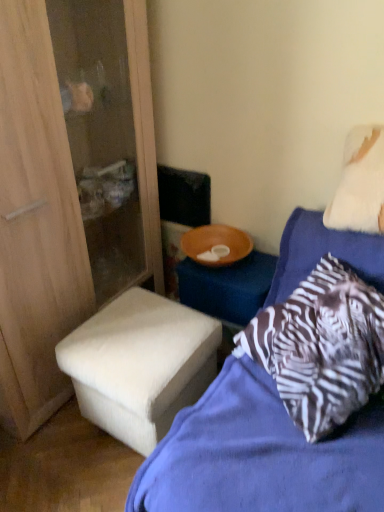
What do you see at coordinates (259, 455) in the screenshot? I see `zebra-patterned pillow at upper right` at bounding box center [259, 455].

You are a GUI agent. You are given a task and a screenshot of the screen. Output one action in this format:
    pyautogui.click(x=<x>, y=<y>)
    Task: Click on the zebra-patterned pillow at upper right
    This screenshot has width=384, height=512.
    Given the screenshot: What is the action you would take?
    pyautogui.click(x=259, y=455)

From the image's perspective, which object appears higher, white fluffy pillow at upper right or zebra-patterned pillow at upper right?

From the image's view, white fluffy pillow at upper right is above.

Is the position of white fluffy pillow at upper right less distant than that of zebra-patterned pillow at upper right?

No, white fluffy pillow at upper right is behind zebra-patterned pillow at upper right.

Considering the sizes of white fluffy pillow at upper right and zebra-patterned pillow at upper right in the image, is white fluffy pillow at upper right wider or thinner than zebra-patterned pillow at upper right?

Clearly, white fluffy pillow at upper right has less width compared to zebra-patterned pillow at upper right.

Is white fluffy pillow at upper right smaller than zebra-patterned pillow at upper right?

Yes, white fluffy pillow at upper right is smaller than zebra-patterned pillow at upper right.

Considering the sizes of objects zebra-patterned pillow at upper right and white fabric stool at lower left in the image provided, who is smaller, zebra-patterned pillow at upper right or white fabric stool at lower left?

Smaller between the two is white fabric stool at lower left.

Considering the relative sizes of zebra-patterned pillow at upper right and white fabric stool at lower left in the image provided, is zebra-patterned pillow at upper right taller than white fabric stool at lower left?

Yes.

From the image's perspective, which one is positioned lower, zebra-patterned pillow at upper right or white fabric stool at lower left?

white fabric stool at lower left.

Which object is wider, zebra-patterned pillow at upper right or white fabric stool at lower left?

Wider between the two is white fabric stool at lower left.

Which is closer to the camera, (342,225) or (71,340)?

The point (342,225) is closer.

Image resolution: width=384 pixels, height=512 pixels. I want to click on pillow above the white fabric stool at lower left (from the image's perspective), so click(360, 183).

Can you confirm if white fluffy pillow at upper right is taller than white fabric stool at lower left?

No.

Is white fluffy pillow at upper right to the left or to the right of white fabric stool at lower left in the image?

Clearly, white fluffy pillow at upper right is on the right of white fabric stool at lower left in the image.

Which is in front, zebra-patterned pillow at upper right or white fluffy pillow at upper right?

Positioned in front is zebra-patterned pillow at upper right.

From the image's perspective, relative to white fluffy pillow at upper right, is zebra-patterned pillow at upper right above or below?

Based on their image positions, zebra-patterned pillow at upper right is located beneath white fluffy pillow at upper right.

Considering the sizes of zebra-patterned pillow at upper right and white fluffy pillow at upper right in the image, is zebra-patterned pillow at upper right taller or shorter than white fluffy pillow at upper right?

Clearly, zebra-patterned pillow at upper right is taller compared to white fluffy pillow at upper right.

Is white fabric stool at lower left not near zebra-patterned pillow at upper right?

That's not correct — white fabric stool at lower left is a little close to zebra-patterned pillow at upper right.

Where is `bed in front of the white fabric stool at lower left`? This screenshot has width=384, height=512. bed in front of the white fabric stool at lower left is located at coordinates click(259, 455).

Based on the photo, can you confirm if white fabric ottoman at lower left is smaller than white fluffy pillow at upper right?

No.

How different are the orientations of white fabric ottoman at lower left and white fluffy pillow at upper right in degrees?

The facing directions of white fabric ottoman at lower left and white fluffy pillow at upper right are 86.3 degrees apart.

From the image's perspective, does white fabric ottoman at lower left appear higher than white fluffy pillow at upper right?

No, from the image's perspective, white fabric ottoman at lower left is not over white fluffy pillow at upper right.

Between white fabric ottoman at lower left and white fabric stool at lower left, which one has larger size?

With larger size is white fabric ottoman at lower left.

From a real-world perspective, who is located higher, white fabric ottoman at lower left or white fabric stool at lower left?

In real-world perspective, white fabric ottoman at lower left is above.

You are a GUI agent. You are given a task and a screenshot of the screen. Output one action in this format:
    pyautogui.click(x=<x>, y=<y>)
    Task: Click on the stool that appears below the white fabric ottoman at lower left (from the image's perspective)
    This screenshot has width=384, height=512.
    Given the screenshot: What is the action you would take?
    pyautogui.click(x=140, y=365)

At what (x,y) coordinates should I click in order to perform the action: click on pillow that is above the zebra-patterned pillow at upper right (from a real-world perspective). Please return your answer as a coordinate pair (x, y). The width and height of the screenshot is (384, 512). Looking at the image, I should click on pyautogui.click(x=360, y=183).

The image size is (384, 512). Find the location of `stool beneath the zebra-patterned pillow at upper right (from a real-world perspective)`. stool beneath the zebra-patterned pillow at upper right (from a real-world perspective) is located at coordinates (140, 365).

Looking at the image, which one is located closer to white fabric ottoman at lower left, white fluffy pillow at upper right or white fabric stool at lower left?

white fabric stool at lower left is closer to white fabric ottoman at lower left.

In the scene shown: Estimate the real-world distances between objects in this image. Which object is closer to white fluffy pillow at upper right, zebra-patterned pillow at upper right or white fabric stool at lower left?

zebra-patterned pillow at upper right is closer to white fluffy pillow at upper right.

Which object lies nearer to the anchor point zebra-patterned pillow at upper right, white fluffy pillow at upper right or white fabric ottoman at lower left?

Based on the image, white fluffy pillow at upper right appears to be nearer to zebra-patterned pillow at upper right.

When comparing their distances from white fluffy pillow at upper right, does zebra-patterned pillow at upper right or white fabric ottoman at lower left seem further?

white fabric ottoman at lower left is positioned further to the anchor white fluffy pillow at upper right.

Looking at the image, which one is located closer to white fabric ottoman at lower left, white fabric stool at lower left or white fluffy pillow at upper right?

white fabric stool at lower left is positioned closer to the anchor white fabric ottoman at lower left.

Looking at the image, which one is located closer to white fluffy pillow at upper right, white fabric stool at lower left or white fabric ottoman at lower left?

white fabric stool at lower left is closer to white fluffy pillow at upper right.

Consider the image. When comparing their distances from white fluffy pillow at upper right, does white fabric ottoman at lower left or white fabric stool at lower left seem closer?

The object closer to white fluffy pillow at upper right is white fabric stool at lower left.

Which object lies nearer to the anchor point white fabric ottoman at lower left, white fabric stool at lower left or zebra-patterned pillow at upper right?

white fabric stool at lower left is closer to white fabric ottoman at lower left.

The width and height of the screenshot is (384, 512). What are the coordinates of `stool between white fabric ottoman at lower left and zebra-patterned pillow at upper right in the horizontal direction` in the screenshot? It's located at (140, 365).

Image resolution: width=384 pixels, height=512 pixels. In order to click on bed between white fabric ottoman at lower left and white fluffy pillow at upper right from left to right in this screenshot , I will do `click(259, 455)`.

You are a GUI agent. You are given a task and a screenshot of the screen. Output one action in this format:
    pyautogui.click(x=<x>, y=<y>)
    Task: Click on the stool between white fabric ottoman at lower left and white fluffy pillow at upper right
    
    Given the screenshot: What is the action you would take?
    pyautogui.click(x=140, y=365)

The width and height of the screenshot is (384, 512). I want to click on bed between white fabric stool at lower left and white fluffy pillow at upper right from left to right, so click(x=259, y=455).